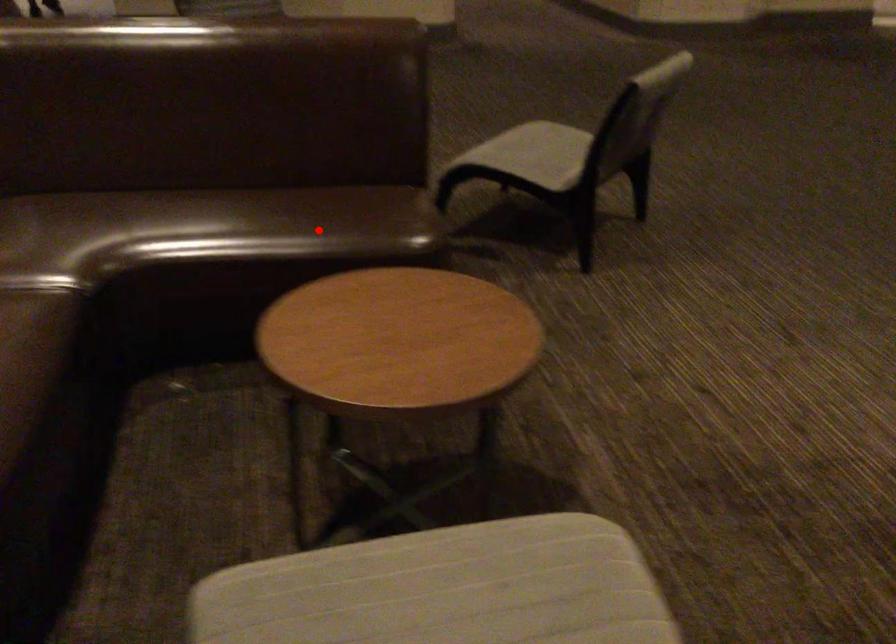
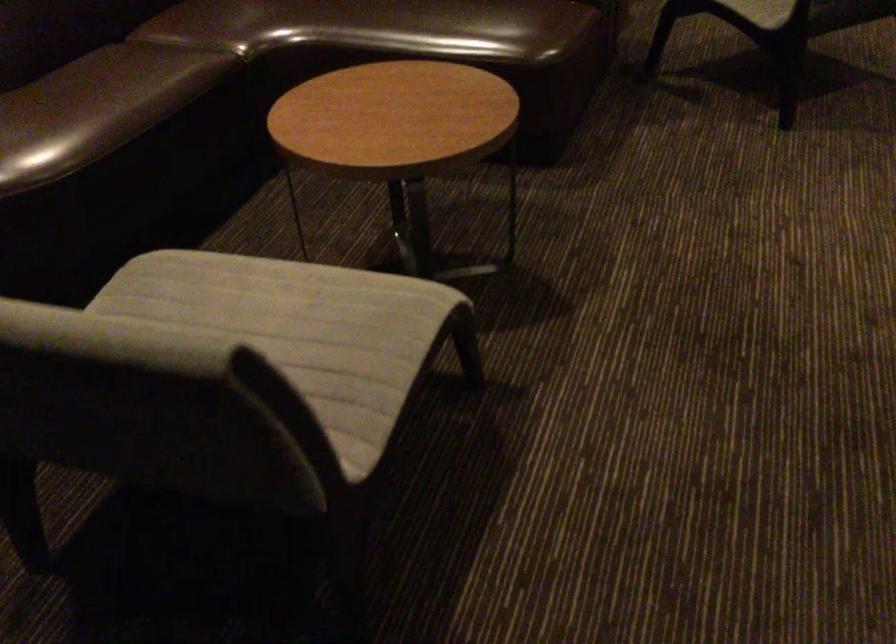
Locate, in the second image, the point that corresponds to the highlighted location in the first image.

(444, 26)